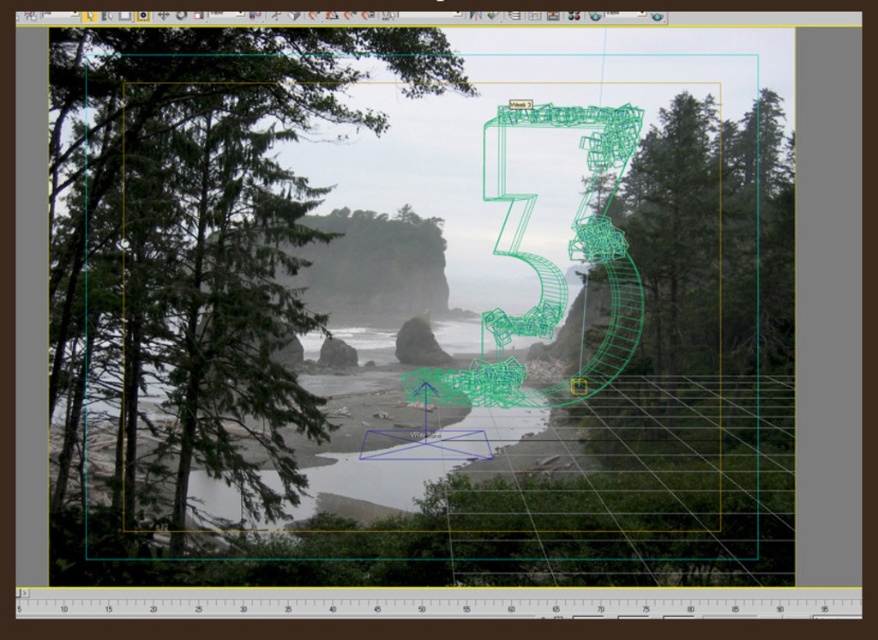
Can you confirm if green matte tree at center is bigger than rough stone rock at center?

Correct, green matte tree at center is larger in size than rough stone rock at center.

Is green matte tree at center below rough stone rock at center?

No.

Is point (171, 116) positioned in front of point (402, 336)?

Yes, it is.

This screenshot has width=878, height=640. What are the coordinates of `green matte tree at center` in the screenshot? It's located at (198, 243).

Is green matte tree at center bigger than green matte tree at center-right?

Incorrect, green matte tree at center is not larger than green matte tree at center-right.

From the picture: Does green matte tree at center have a lesser height compared to green matte tree at center-right?

In fact, green matte tree at center may be taller than green matte tree at center-right.

Is point (171, 166) behind point (677, 140)?

No.

The image size is (878, 640). I want to click on green matte tree at center, so click(198, 243).

Who is shorter, green matte tree at center-right or rough stone rock at center?

rough stone rock at center is shorter.

Image resolution: width=878 pixels, height=640 pixels. I want to click on green matte tree at center-right, so click(711, 240).

Who is more distant from viewer, (697,296) or (427,323)?

The point (427,323) is more distant.

Where is `green matte tree at center-right`? The height and width of the screenshot is (640, 878). green matte tree at center-right is located at coordinates (711, 240).